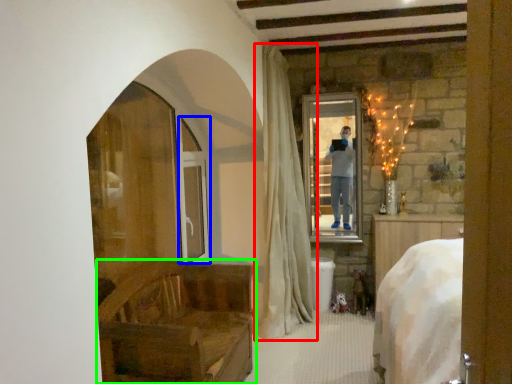
Question: Which is nearer to the curtain (highlighted by a red box)? screen door (highlighted by a blue box) or furniture (highlighted by a green box).

Choices:
 (A) screen door
 (B) furniture

Answer: (A)